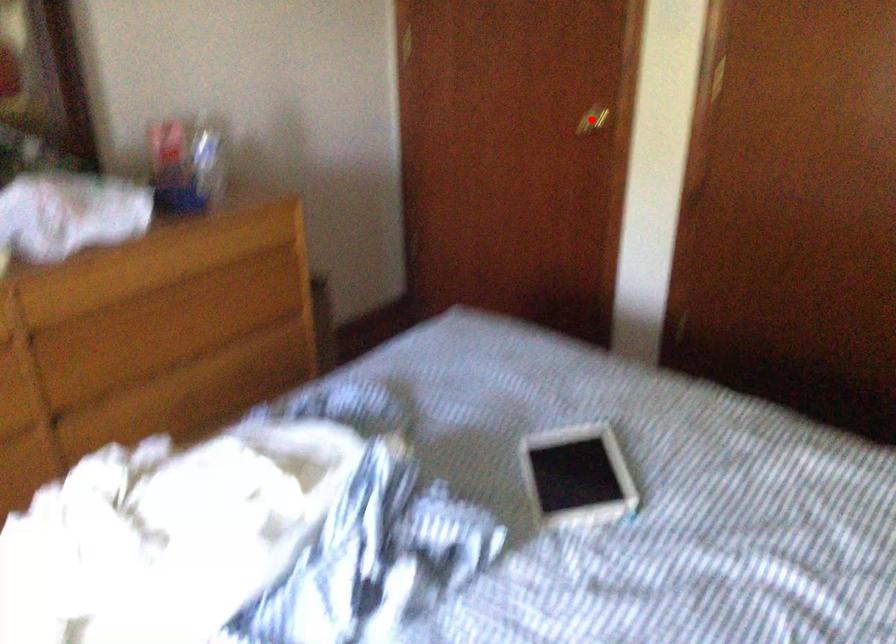
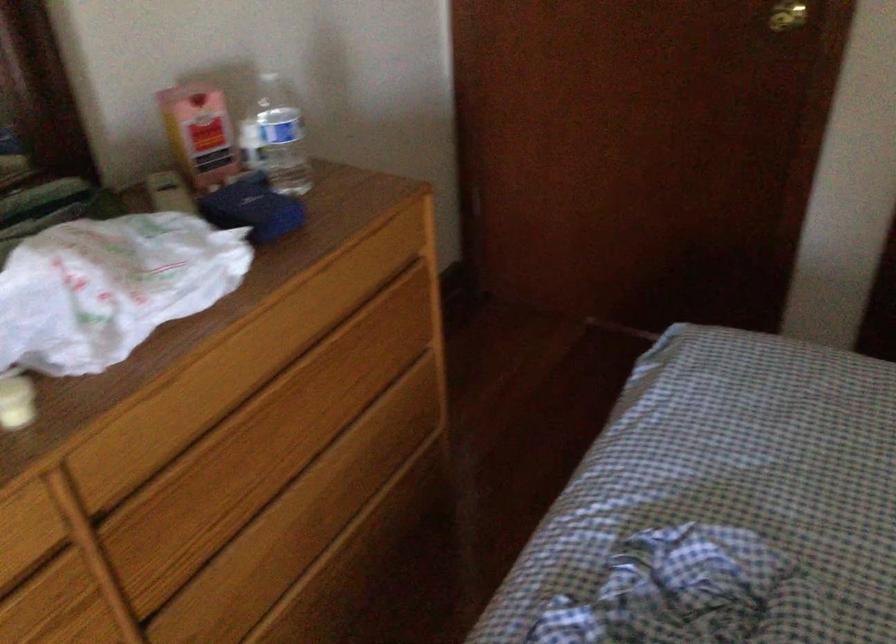
Question: I am providing you with two images of the same scene from different viewpoints. Given a red point in image1, look at the same physical point in image2. Is it:

Choices:
 (A) Closer to the viewpoint
 (B) Farther from the viewpoint

Answer: (A)